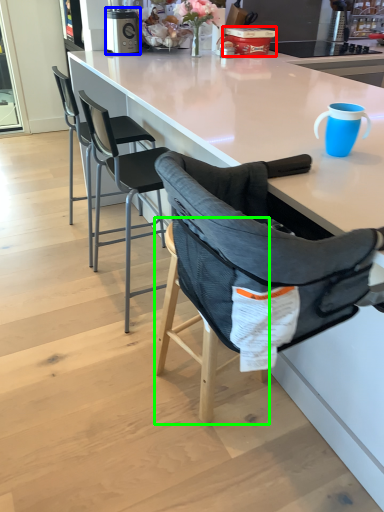
Question: Estimate the real-world distances between objects in this image. Which object is farther from appliance (highlighted by a red box), kitchen appliance (highlighted by a blue box) or bar stool (highlighted by a green box)?

Choices:
 (A) kitchen appliance
 (B) bar stool

Answer: (B)